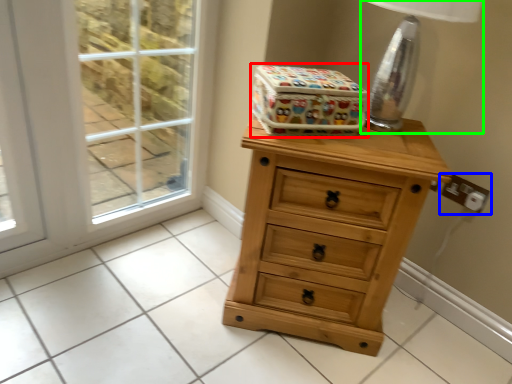
Question: Which is nearer to the storage box (highlighted by a red box)? electric outlet (highlighted by a blue box) or table lamp (highlighted by a green box).

Choices:
 (A) electric outlet
 (B) table lamp

Answer: (B)